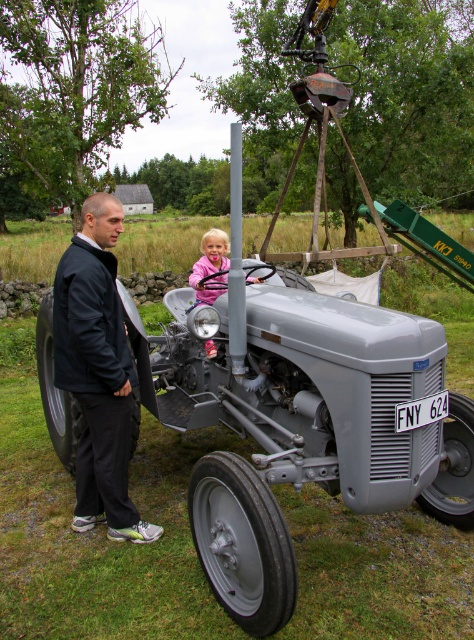
Question: Which of the following is the farthest from the observer?

Choices:
 (A) (181, 362)
 (B) (81, 513)
 (C) (200, 268)

Answer: (C)

Question: Which point appears closest to the camera in this image?

Choices:
 (A) (246, 536)
 (B) (129, 385)
 (C) (209, 355)

Answer: (A)

Question: Can you confirm if black fabric jacket at left is positioned below pink fabric at center?

Choices:
 (A) no
 (B) yes

Answer: (B)

Question: Which point is farther to the camera?

Choices:
 (A) black fabric jacket at left
 (B) pink fabric at center

Answer: (B)

Question: Is black fabric jacket at left closer to camera compared to pink fabric at center?

Choices:
 (A) no
 (B) yes

Answer: (B)

Question: Does metallic gray tractor at center appear over pink fabric at center?

Choices:
 (A) no
 (B) yes

Answer: (A)